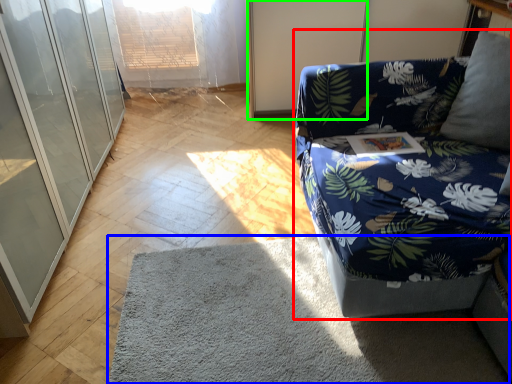
Question: Based on their relative distances, which object is farther from studio couch (highlighted by a red box)? Choose from mat (highlighted by a blue box) and screen door (highlighted by a green box).

Choices:
 (A) mat
 (B) screen door

Answer: (B)